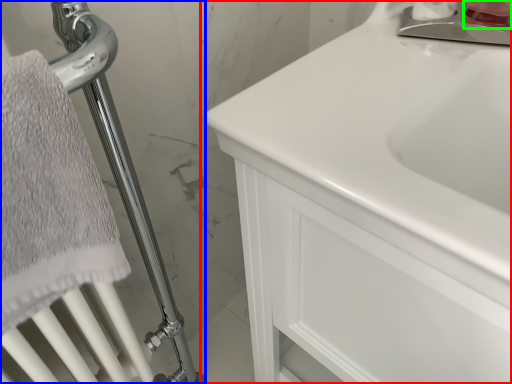
Question: Which object is the farthest from bathroom cabinet (highlighted by a red box)? Choose among these: shower (highlighted by a blue box) or toiletry (highlighted by a green box).

Choices:
 (A) shower
 (B) toiletry

Answer: (B)